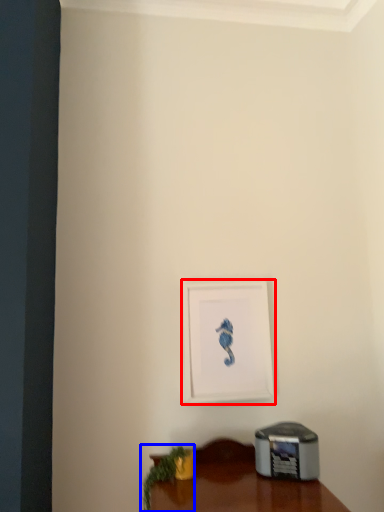
Question: Which object is further to the camera taking this photo, picture frame (highlighted by a red box) or plant (highlighted by a blue box)?

Choices:
 (A) picture frame
 (B) plant

Answer: (A)